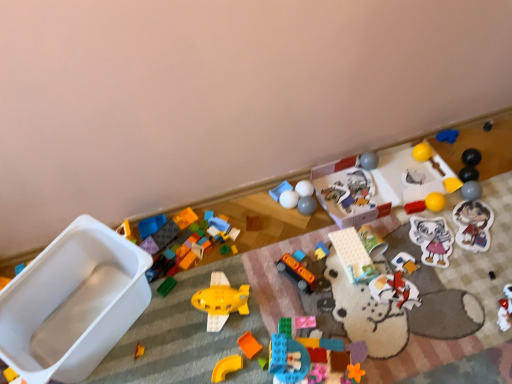
Where is `vacant area that lies between matte plastic stickers at lower right, the 23th toy viewed from the left, and yellow plastic airplane at center, the 22th toy in the right-to-left sequence`? Image resolution: width=512 pixels, height=384 pixels. vacant area that lies between matte plastic stickers at lower right, the 23th toy viewed from the left, and yellow plastic airplane at center, the 22th toy in the right-to-left sequence is located at coordinates (367, 269).